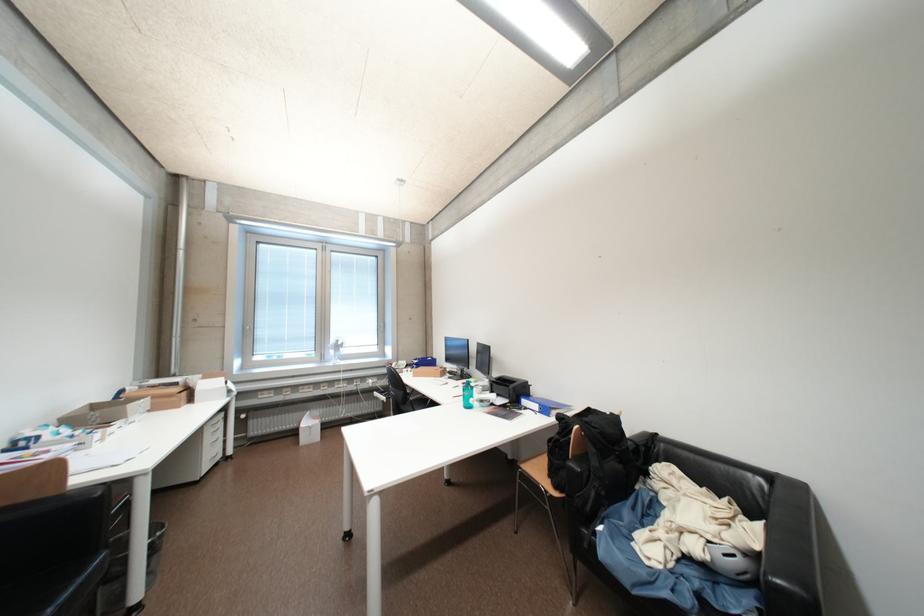
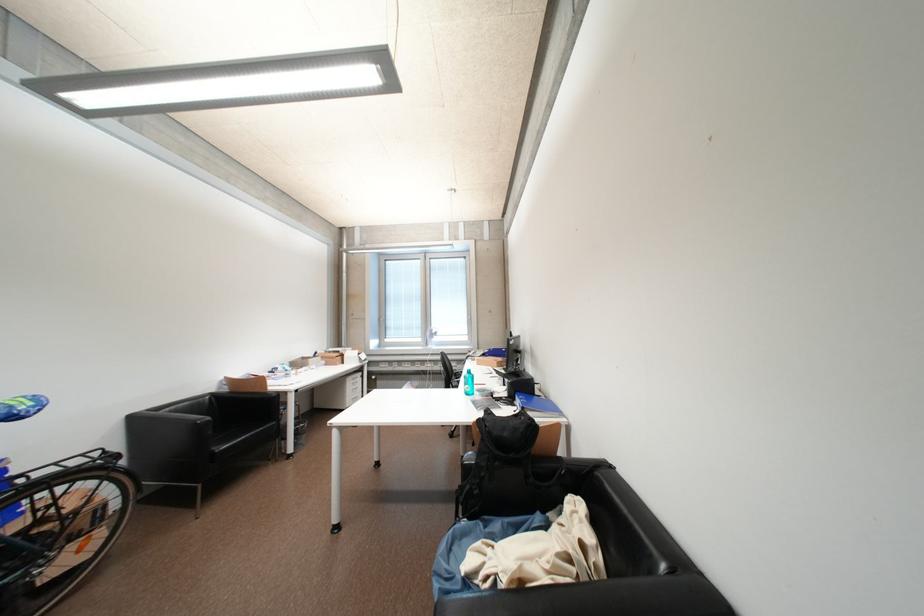
Locate, in the second image, the point that corresponds to the point at 216,432 in the first image.

(358, 384)